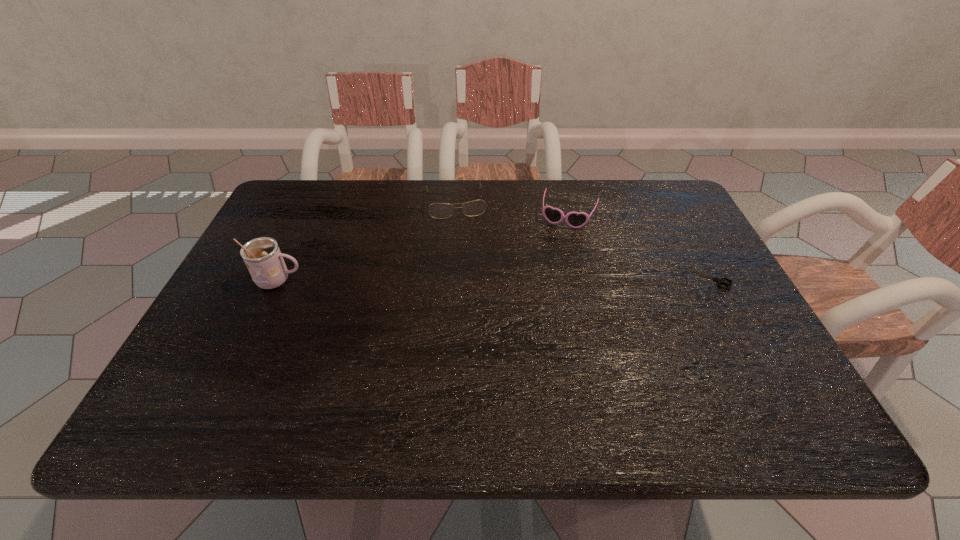
Where is `vacant space located 0.060m on the front-facing side of the third object from right to left`? The image size is (960, 540). vacant space located 0.060m on the front-facing side of the third object from right to left is located at coordinates (461, 232).

Locate an element on the screen. This screenshot has width=960, height=540. vacant space located on the front-facing side of the sunglasses is located at coordinates (529, 325).

The width and height of the screenshot is (960, 540). I want to click on vacant space located 0.210m on the front-facing side of the sunglasses, so click(545, 278).

Find the location of a particular element. The width and height of the screenshot is (960, 540). vacant space located 0.120m on the front-facing side of the sunglasses is located at coordinates (553, 256).

Find the location of a particular element. spectacles present at the far edge is located at coordinates click(x=477, y=207).

You are a GUI agent. You are given a task and a screenshot of the screen. Output one action in this format:
    pyautogui.click(x=<x>, y=<y>)
    Task: Click on the sunglasses present at the far edge
    Image resolution: width=960 pixels, height=540 pixels.
    Given the screenshot: What is the action you would take?
    pyautogui.click(x=553, y=215)

Locate an element on the screen. The width and height of the screenshot is (960, 540). object present at the left edge is located at coordinates pos(262,256).

The width and height of the screenshot is (960, 540). I want to click on object present at the right edge, so click(719, 280).

The height and width of the screenshot is (540, 960). In the image, there is a desktop. Find the location of `blank space at the far edge`. blank space at the far edge is located at coordinates (340, 217).

Identify the location of vacant region at the near edge of the desktop. The image size is (960, 540). (508, 383).